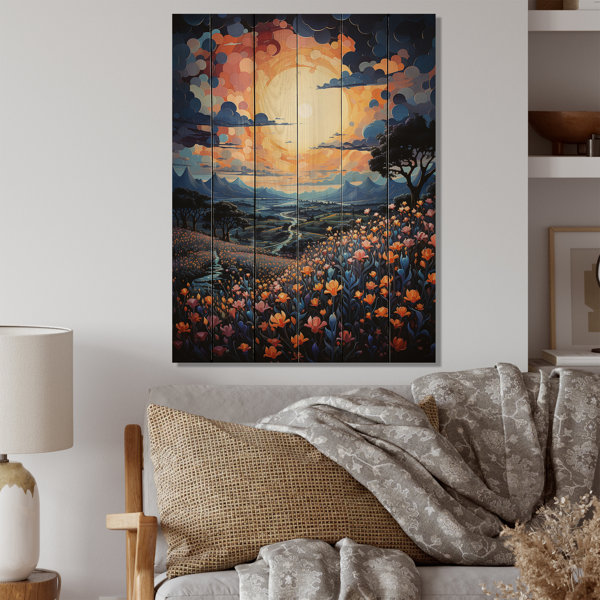
This screenshot has width=600, height=600. In order to click on brown on top part of lamp in this screenshot , I will do `click(13, 475)`.